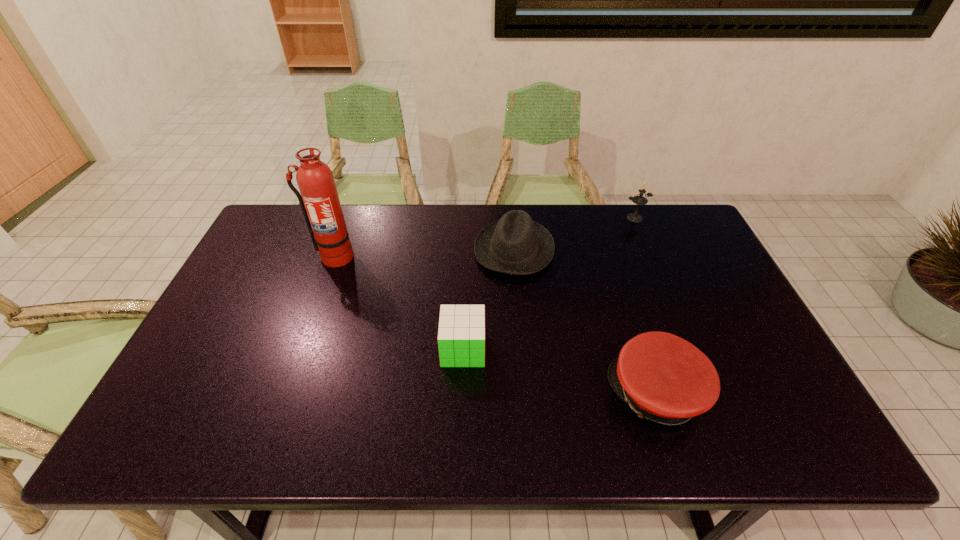
The image size is (960, 540). I want to click on the tallest object, so click(x=319, y=200).

This screenshot has width=960, height=540. What are the coordinates of `fire extinguisher` in the screenshot? It's located at (319, 200).

Where is `candle holder`? This screenshot has width=960, height=540. candle holder is located at coordinates (639, 200).

Identify the location of the fourth shortest object. The height and width of the screenshot is (540, 960). (639, 200).

Identify the location of fedora. The image size is (960, 540). (515, 245).

Image resolution: width=960 pixels, height=540 pixels. In order to click on cube in this screenshot , I will do (x=461, y=334).

The height and width of the screenshot is (540, 960). What are the coordinates of `cap` in the screenshot? It's located at (662, 377).

Identify the location of vacant space situated 0.330m on the label side of the leftmost object. click(x=298, y=355).

This screenshot has height=540, width=960. Identify the location of free location located 0.120m on the left of the candle holder. (588, 218).

I want to click on free location located 0.150m on the front of the fedora, so click(519, 319).